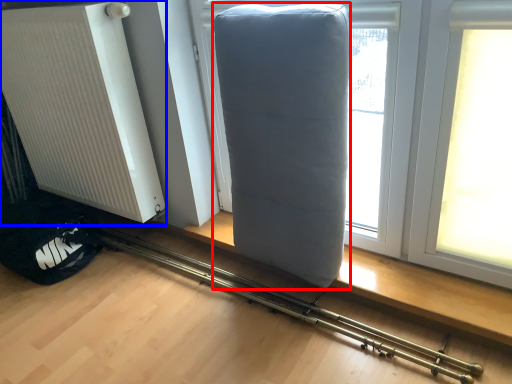
Question: Which object is closer to the camera taking this photo, furniture (highlighted by a red box) or radiator (highlighted by a blue box)?

Choices:
 (A) furniture
 (B) radiator

Answer: (A)